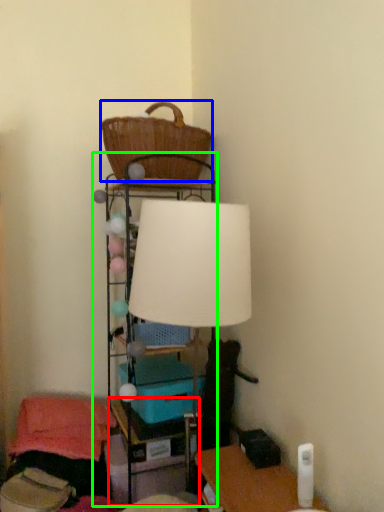
Question: Considering the real-world distances, which object is closest to table (highlighted by a red box)? basket (highlighted by a blue box) or shelf (highlighted by a green box).

Choices:
 (A) basket
 (B) shelf

Answer: (B)